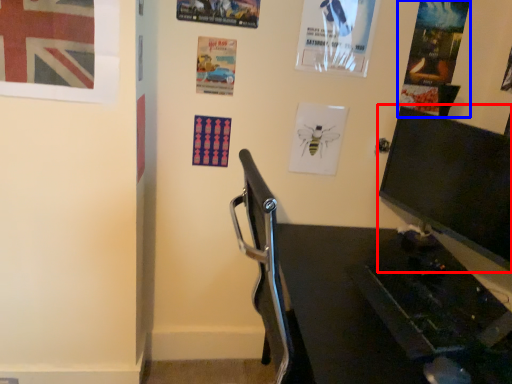
Question: Among these objects, which one is nearest to the camera, computer monitor (highlighted by a red box) or poster page (highlighted by a blue box)?

Choices:
 (A) computer monitor
 (B) poster page

Answer: (A)